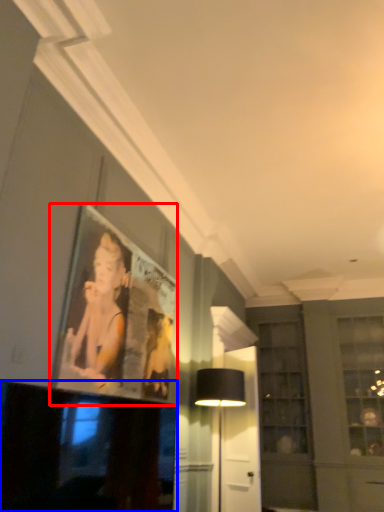
Question: Which point is closer to the camera, picture frame (highlighted by a red box) or television (highlighted by a blue box)?

Choices:
 (A) picture frame
 (B) television

Answer: (B)